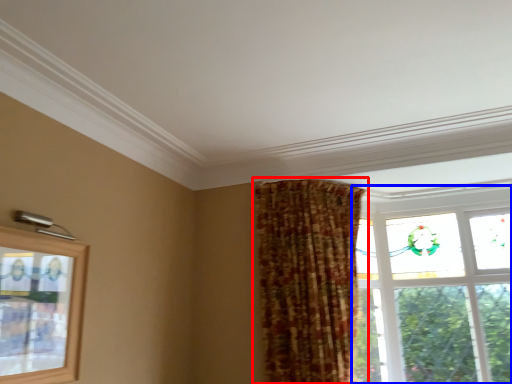
Question: Which object appears closest to the camera in this image, curtain (highlighted by a red box) or window (highlighted by a blue box)?

Choices:
 (A) curtain
 (B) window

Answer: (A)